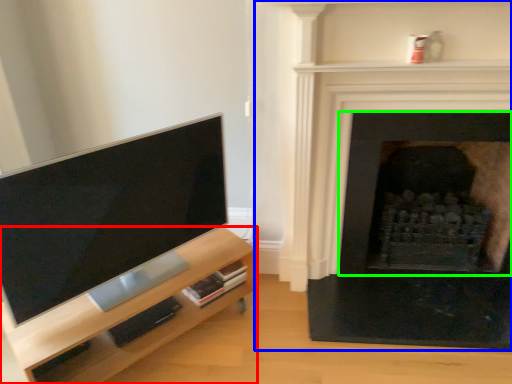
Question: Based on their relative distances, which object is farther from entertainment center (highlighted by a red box)? Choose from fireplace (highlighted by a blue box) and fireplace (highlighted by a green box).

Choices:
 (A) fireplace
 (B) fireplace

Answer: (B)